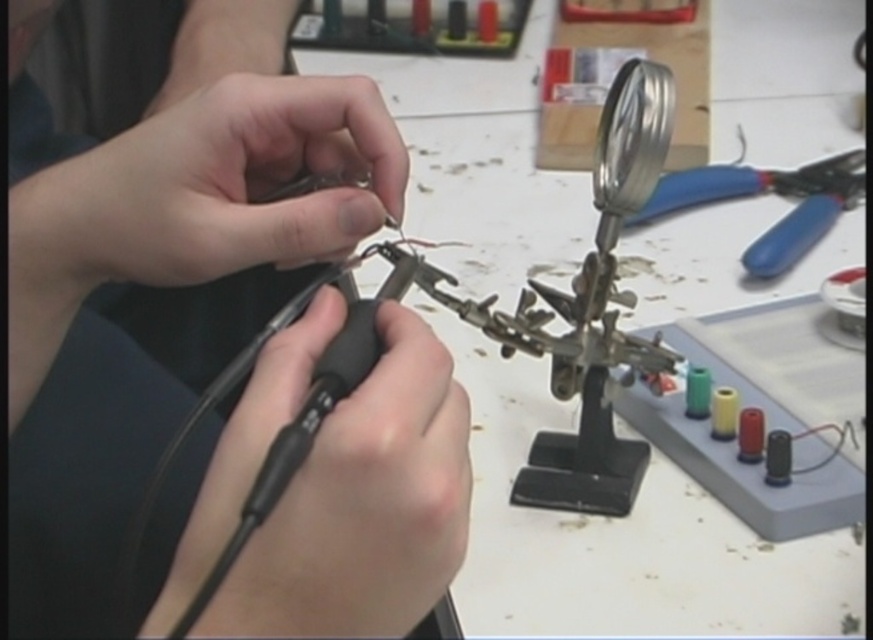
Question: Estimate the real-world distances between objects in this image. Which object is closer to the matte black tool at center?

Choices:
 (A) black rubberized pliers at center
 (B) black rubberized grip at center
 (C) metallic silver magnifying glass at upper right
 (D) blue plastic pliers at upper right

Answer: (A)

Question: Which point is farther from the camera taking this photo?

Choices:
 (A) (382, 214)
 (B) (605, 196)
 (C) (286, 148)
 (D) (803, 168)

Answer: (D)

Question: Observing the image, what is the correct spatial positioning of black rubberized grip at center in reference to blue plastic pliers at upper right?

Choices:
 (A) right
 (B) left

Answer: (B)

Question: Does black rubberized grip at center have a larger size compared to blue plastic pliers at upper right?

Choices:
 (A) no
 (B) yes

Answer: (A)

Question: Which of the following is the farthest from the observer?

Choices:
 (A) black rubberized pliers at center
 (B) blue plastic pliers at upper right
 (C) black rubberized grip at center
 (D) metallic silver magnifying glass at upper right

Answer: (B)

Question: Is black rubberized grip at center closer to camera compared to blue plastic pliers at upper right?

Choices:
 (A) no
 (B) yes

Answer: (B)